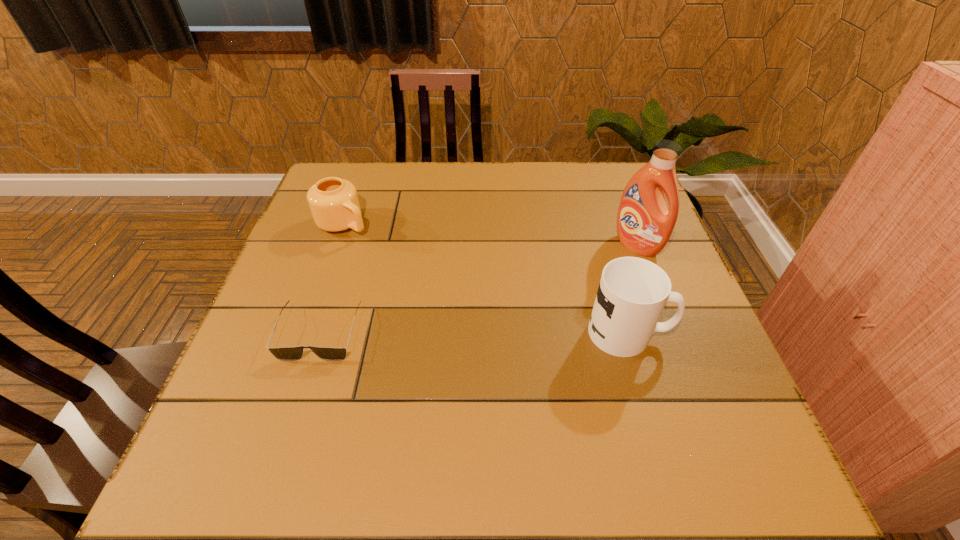
Image resolution: width=960 pixels, height=540 pixels. I want to click on free spot at the far left corner of the desktop, so click(x=363, y=186).

At what (x,y) coordinates should I click in order to perform the action: click on free space at the near left corner of the desktop. Please return your answer as a coordinate pair (x, y). The image size is (960, 540). Looking at the image, I should click on (271, 422).

Identify the location of free space at the far right corner. (612, 167).

You are a GUI agent. You are given a task and a screenshot of the screen. Output one action in this format:
    pyautogui.click(x=<x>, y=<y>)
    Task: Click on the vacant space in between the tallest object and the shortest object
    The width and height of the screenshot is (960, 540).
    Given the screenshot: What is the action you would take?
    pyautogui.click(x=478, y=289)

Identify the location of empty location between the shorter mug and the detergent. Image resolution: width=960 pixels, height=540 pixels. (490, 235).

Where is `vacant point located between the tallest object and the left mug`? The height and width of the screenshot is (540, 960). vacant point located between the tallest object and the left mug is located at coordinates (490, 235).

The image size is (960, 540). I want to click on unoccupied area between the farther mug and the nearer mug, so click(x=486, y=279).

Locate an element on the screen. The height and width of the screenshot is (540, 960). vacant area that lies between the sunglasses and the nearer mug is located at coordinates (474, 333).

Locate an element on the screen. empty space between the shorter mug and the shortest object is located at coordinates (332, 279).

Find the location of a particular element. vacant region between the nearer mug and the sunglasses is located at coordinates (474, 333).